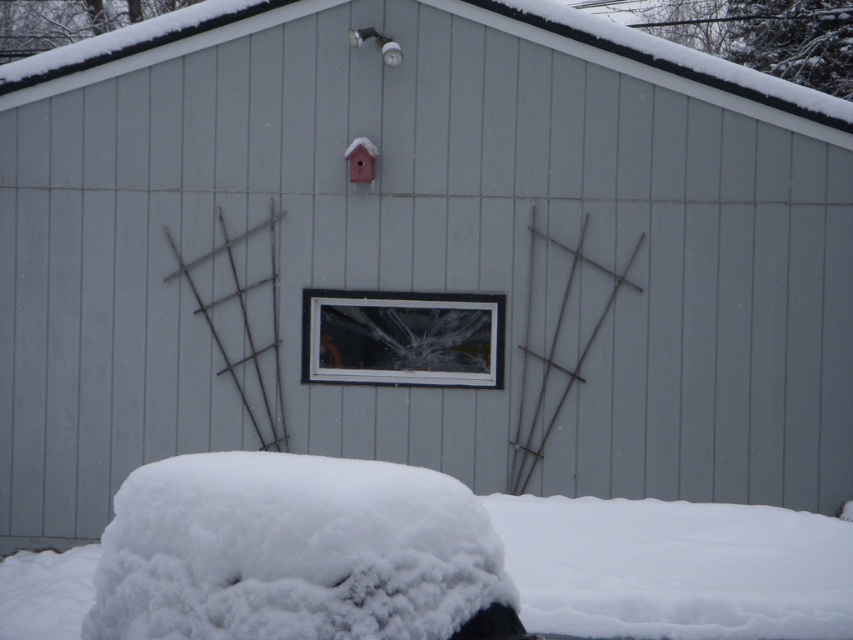
You are a delivery person trying to deliver a package to the clear glass window at center. You see the white fluffy snow at lower center. Is the snow blocking your path to the window?

The white fluffy snow at lower center is located below the clear glass window at center, so it is not blocking the path to the window.

You are standing in front of the gray building and want to see the clear glass window at center. Is the white fluffy snow at lower center blocking your view of it?

The white fluffy snow at lower center is not as tall as the clear glass window at center, so it is not blocking your view of the window.